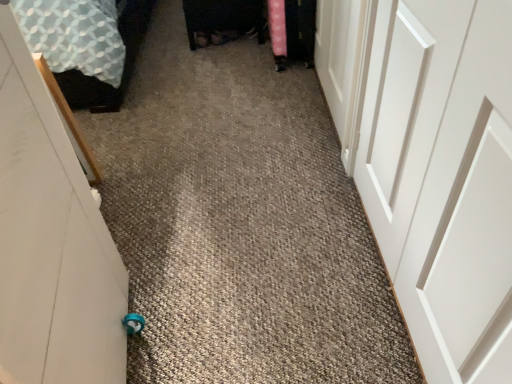
Find the location of a particular element. vacant area that lies to the right of white matte door at left, placed as the first door when sorted from left to right is located at coordinates (243, 329).